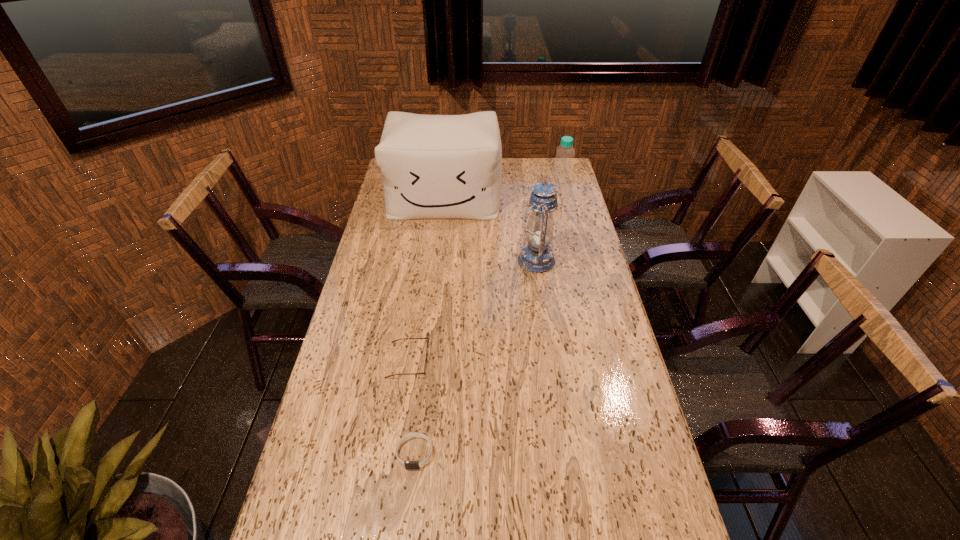
You are a GUI agent. You are given a task and a screenshot of the screen. Output one action in this format:
    pyautogui.click(x=<x>, y=<y>)
    Task: Click on the object located in the far left corner section of the desktop
    
    Given the screenshot: What is the action you would take?
    pyautogui.click(x=432, y=166)

You are a GUI agent. You are given a task and a screenshot of the screen. Output one action in this format:
    pyautogui.click(x=<x>, y=<y>)
    Task: Click on the object located at the far right corner
    
    Given the screenshot: What is the action you would take?
    pyautogui.click(x=563, y=167)

This screenshot has height=540, width=960. In the image, there is a desktop. What are the coordinates of `vacant region at the far edge` in the screenshot? It's located at (514, 163).

Image resolution: width=960 pixels, height=540 pixels. I want to click on blank space at the left edge of the desktop, so click(x=337, y=436).

At what (x,y) coordinates should I click in order to perform the action: click on free location at the right edge. Please return your answer as a coordinate pair (x, y). This screenshot has height=540, width=960. Looking at the image, I should click on [608, 431].

This screenshot has height=540, width=960. Identify the location of free space between the cushion and the third nearest object. (491, 230).

At what (x,y) coordinates should I click in order to perform the action: click on vacant space in between the spectacles and the bottle. Please return your answer as a coordinate pair (x, y). The height and width of the screenshot is (540, 960). Looking at the image, I should click on (485, 270).

Image resolution: width=960 pixels, height=540 pixels. Find the location of `unoccupied position between the cushion and the rightmost object`. unoccupied position between the cushion and the rightmost object is located at coordinates (503, 189).

Where is `vacant region between the cushion and the second nearest object`? vacant region between the cushion and the second nearest object is located at coordinates (426, 279).

Locate an element on the screen. vacant area that lies between the cushion and the lantern is located at coordinates (491, 230).